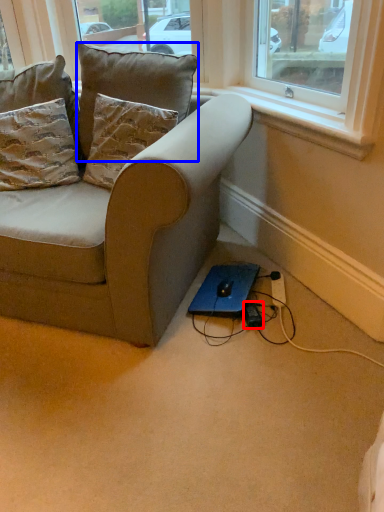
Question: Among these objects, which one is farthest to the camera, plug (highlighted by a red box) or pillow (highlighted by a blue box)?

Choices:
 (A) plug
 (B) pillow

Answer: (A)